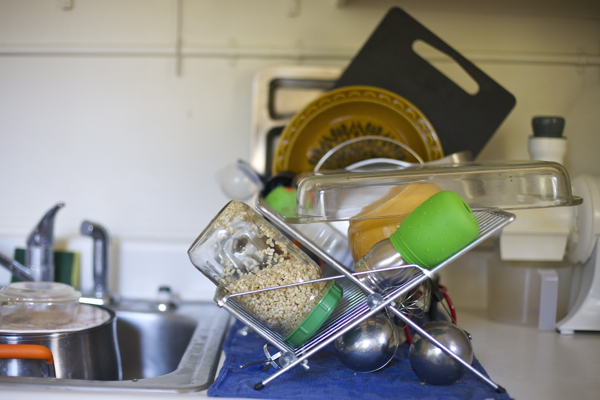
Find the location of a particular element. white wall is located at coordinates (237, 22).